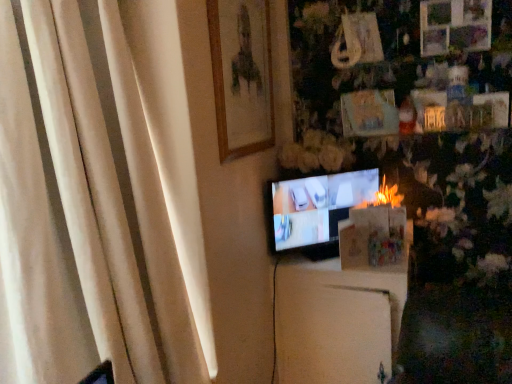
Question: In the image, is white fabric curtain at left positioned in front of or behind matte black tv at center?

Choices:
 (A) behind
 (B) front

Answer: (B)

Question: Would you say white fabric curtain at left is to the left or to the right of matte black tv at center in the picture?

Choices:
 (A) left
 (B) right

Answer: (A)

Question: Which is farther from the white matte cabinet at center?

Choices:
 (A) matte black tv at center
 (B) wooden framed portrait at upper center
 (C) white fabric curtain at left

Answer: (C)

Question: Considering the real-world distances, which object is closest to the white fabric curtain at left?

Choices:
 (A) wooden framed portrait at upper center
 (B) white matte cabinet at center
 (C) matte black tv at center

Answer: (A)